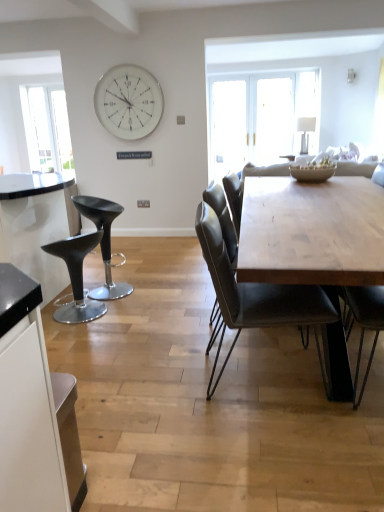
Question: From the image's perspective, is porcelain textured bowl at center located above or below leather seat at center?

Choices:
 (A) below
 (B) above

Answer: (B)

Question: From a real-world perspective, is porcelain textured bowl at center physically located above or below leather seat at center?

Choices:
 (A) above
 (B) below

Answer: (A)

Question: Which of these objects is positioned closest to the white metallic clock at upper center?

Choices:
 (A) porcelain textured bowl at center
 (B) black leather stool at left, the 2th stool when ordered from back to front
 (C) white glossy lampshade at upper center
 (D) matte black stool at left, which is counted as the 2th stool, starting from the front
 (E) leather seat at center

Answer: (D)

Question: Which object is the farthest from the leather seat at center?

Choices:
 (A) porcelain textured bowl at center
 (B) white glossy lampshade at upper center
 (C) matte black stool at left, which is counted as the 2th stool, starting from the front
 (D) white metallic clock at upper center
 (E) transparent glass window at left

Answer: (E)